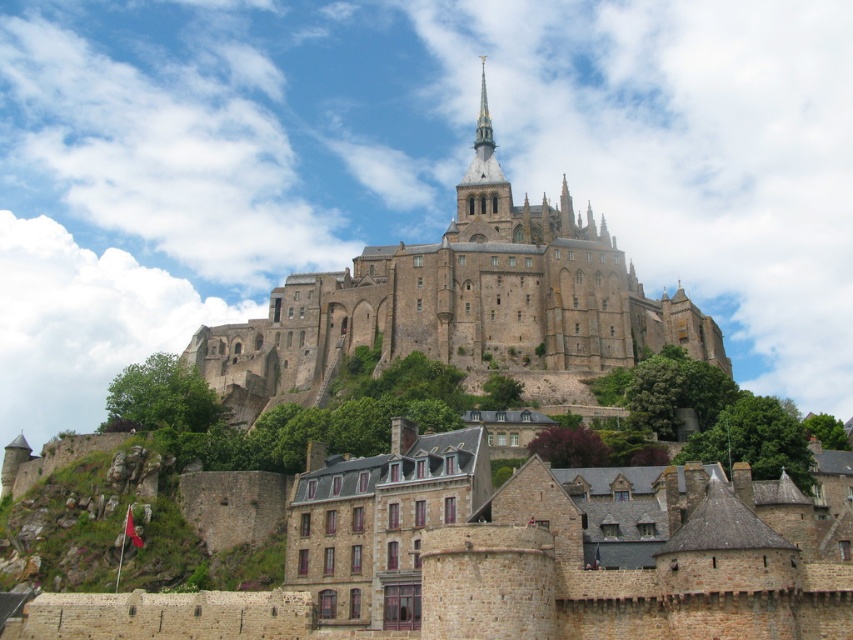
Question: Which point is closer to the camera?

Choices:
 (A) (552, 289)
 (B) (477, 129)

Answer: (A)

Question: Which point is closer to the camera taking this photo?

Choices:
 (A) (476, 154)
 (B) (378, 282)

Answer: (B)

Question: Observing the image, what is the correct spatial positioning of stone castle at center in reference to smooth stone spire at upper center?

Choices:
 (A) right
 (B) left

Answer: (B)

Question: Can you confirm if stone castle at center is wider than smooth stone spire at upper center?

Choices:
 (A) no
 (B) yes

Answer: (B)

Question: Does stone castle at center appear under smooth stone spire at upper center?

Choices:
 (A) yes
 (B) no

Answer: (A)